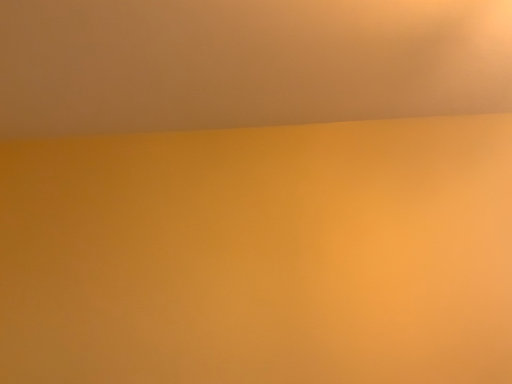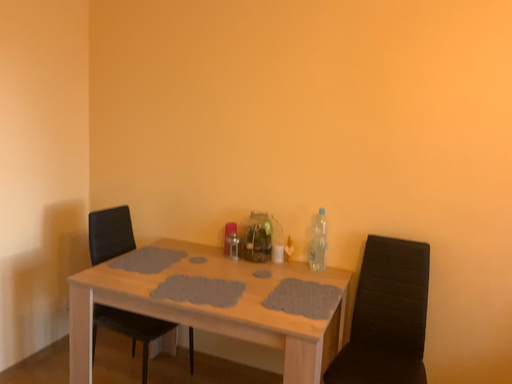
Question: Which way did the camera rotate in the video?

Choices:
 (A) rotated upward
 (B) rotated downward

Answer: (B)